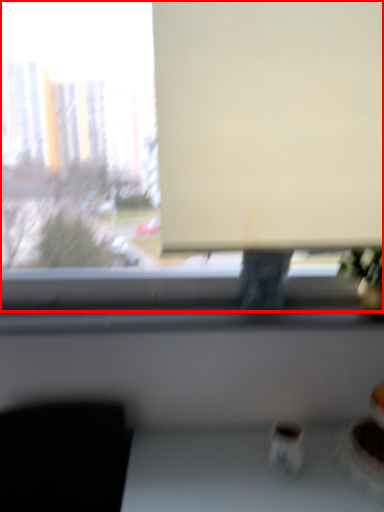
Question: From the image, what is the correct spatial relationship of window (annotated by the red box) in relation to projection screen?

Choices:
 (A) left
 (B) right

Answer: (A)